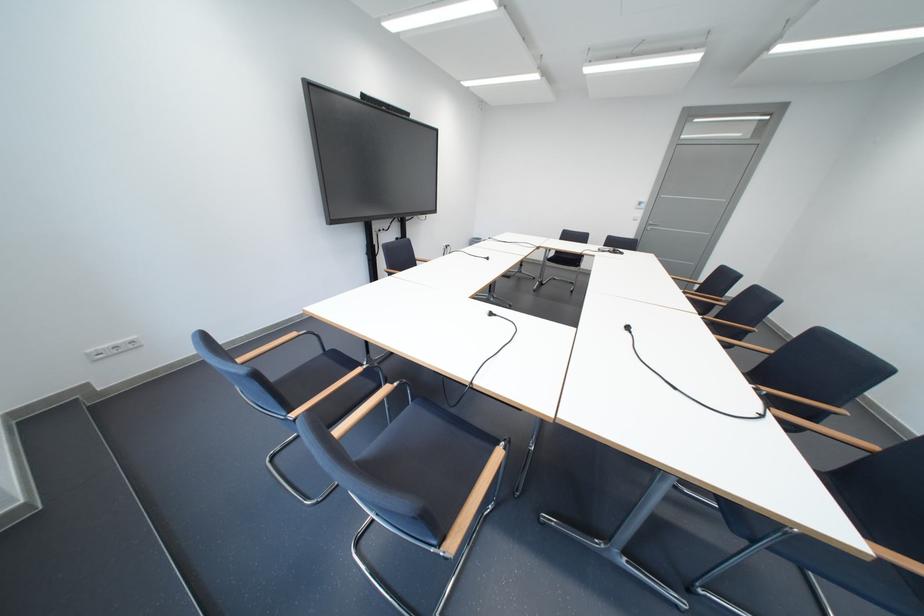
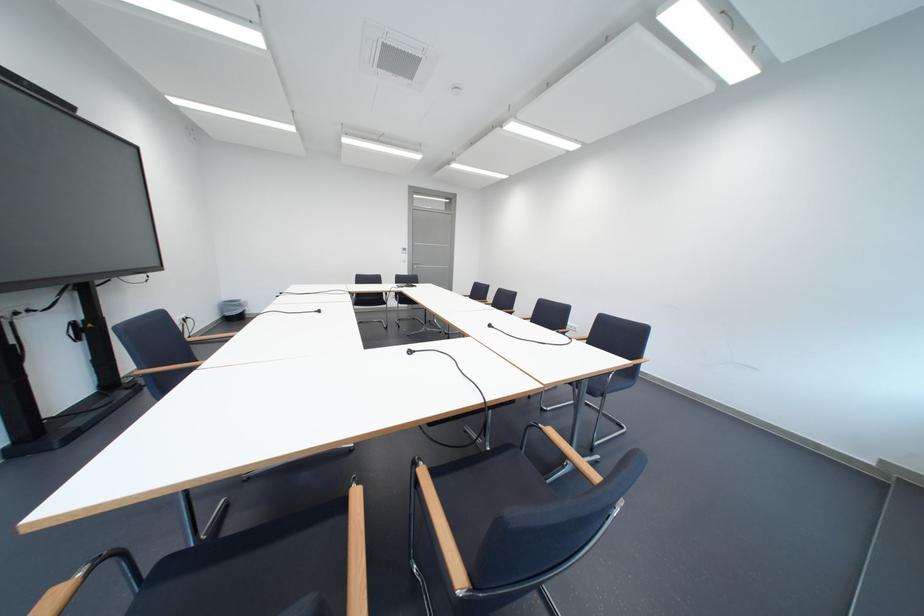
In the second image, find the point that corresponds to pixel 660 227 in the first image.

(426, 265)